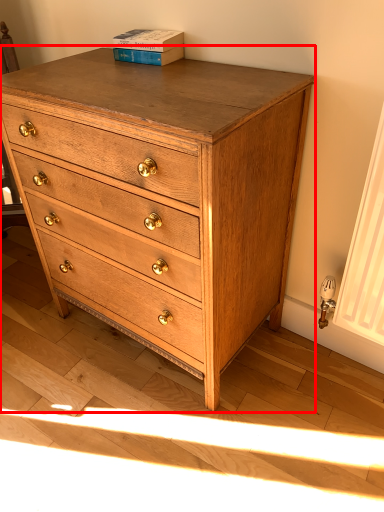
Question: From the image's perspective, what is the correct spatial positioning of chest of drawers (annotated by the red box) in reference to paperback book?

Choices:
 (A) below
 (B) above

Answer: (A)